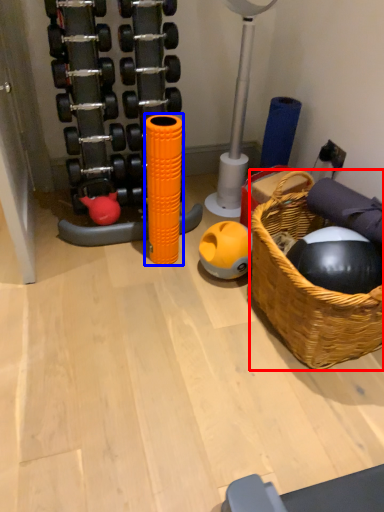
Question: Among these objects, which one is farthest to the camera, basket (highlighted by a red box) or toy (highlighted by a blue box)?

Choices:
 (A) basket
 (B) toy

Answer: (B)